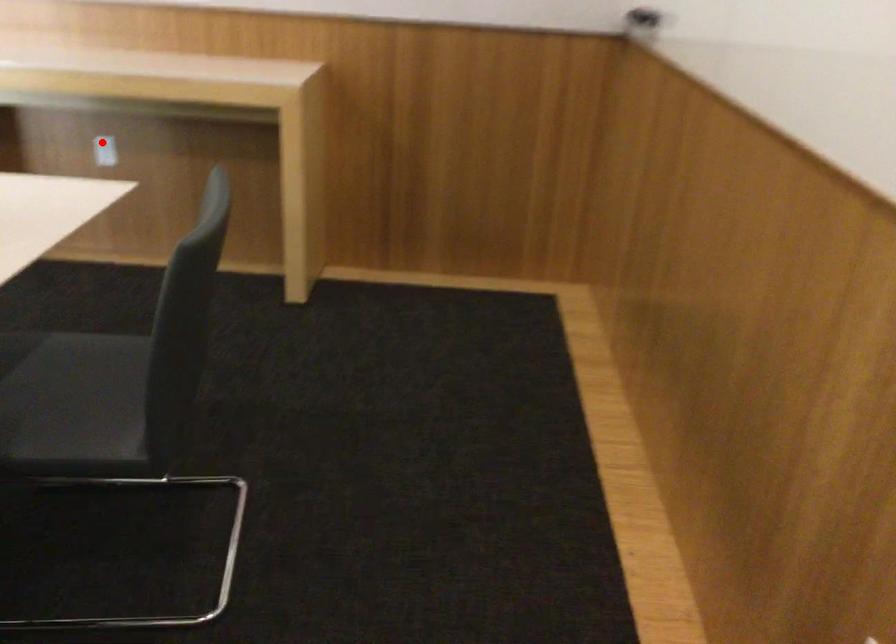
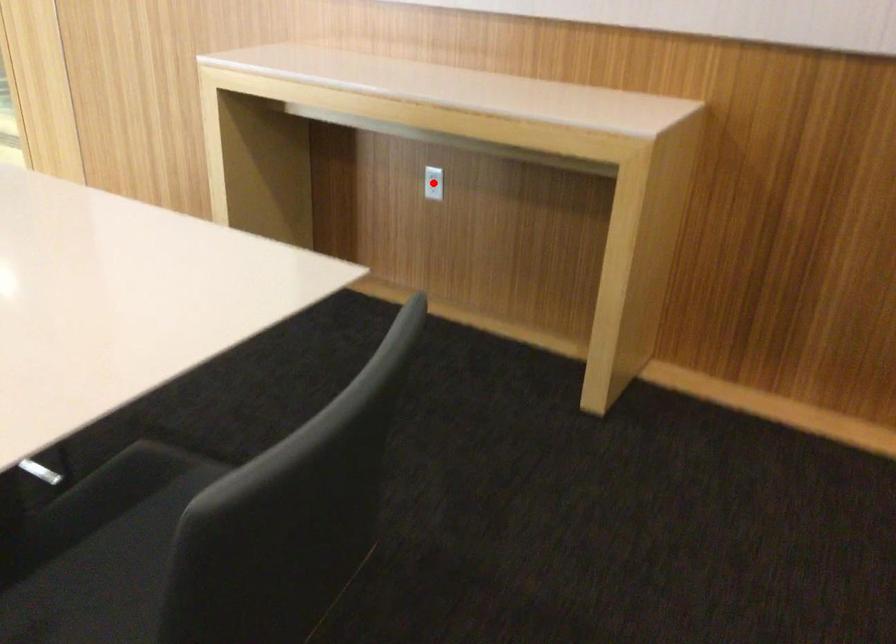
I am providing you with two images of the same scene from different viewpoints. A red point is marked on the first image and another point is marked on the second image. Do the highlighted points in image1 and image2 indicate the same real-world spot?

Yes